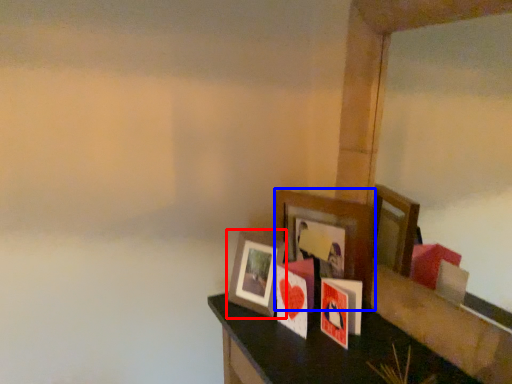
Question: Which of the following is the closest to the observer, picture frame (highlighted by a red box) or picture frame (highlighted by a blue box)?

Choices:
 (A) picture frame
 (B) picture frame

Answer: (B)